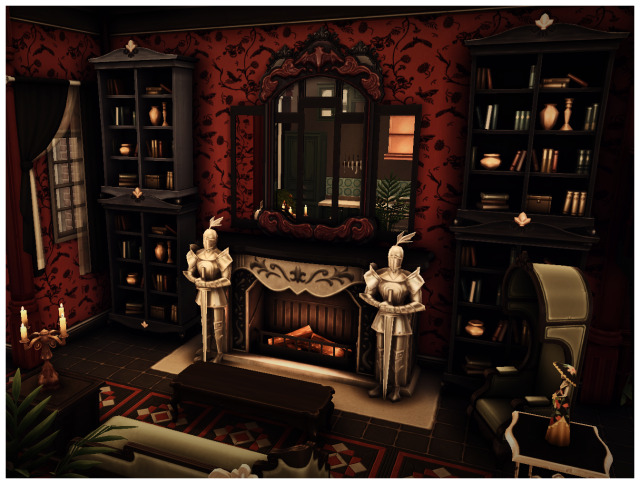
At what (x,y) coordinates should I click in order to perform the action: click on shelves. Please return your answer as a coordinate pair (x, y). The width and height of the screenshot is (640, 484). Looking at the image, I should click on (123, 116), (134, 277), (502, 145), (484, 295).